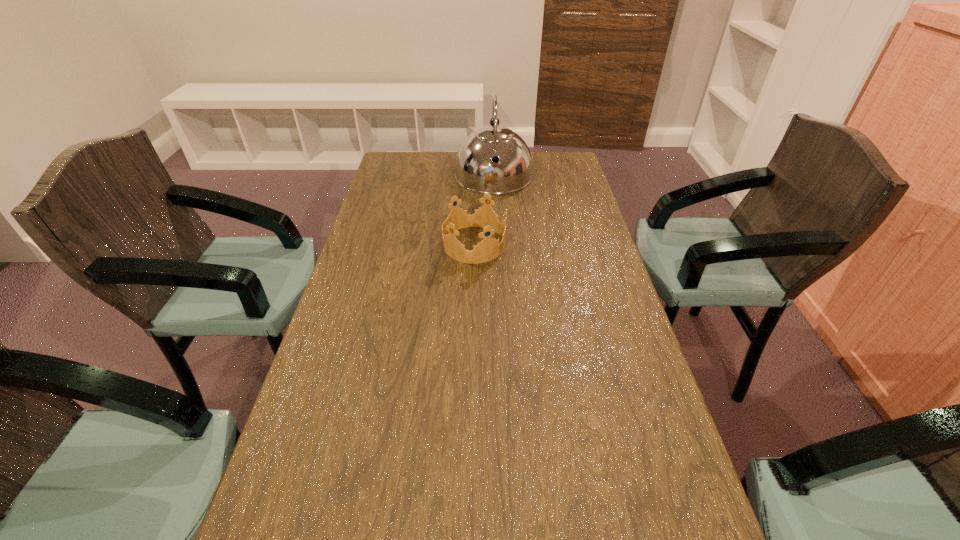
Image resolution: width=960 pixels, height=540 pixels. I want to click on the taller object, so click(475, 170).

This screenshot has height=540, width=960. Identify the location of the farther object. (475, 170).

Find the location of a particular element. The height and width of the screenshot is (540, 960). the nearer object is located at coordinates (488, 249).

The width and height of the screenshot is (960, 540). What are the coordinates of `tiara` in the screenshot? It's located at (488, 249).

I want to click on free space located from the spout of the taller object, so click(496, 229).

What are the coordinates of `vacant region located on the front-facing side of the nearer object` in the screenshot? It's located at (545, 244).

This screenshot has width=960, height=540. Find the location of `object located in the far edge section of the desktop`. object located in the far edge section of the desktop is located at coordinates (475, 170).

I want to click on vacant position at the far edge of the desktop, so click(433, 173).

Identify the location of vacant area at the left edge. Image resolution: width=960 pixels, height=540 pixels. (376, 244).

Where is `vacant space at the right edge`? Image resolution: width=960 pixels, height=540 pixels. vacant space at the right edge is located at coordinates (587, 429).